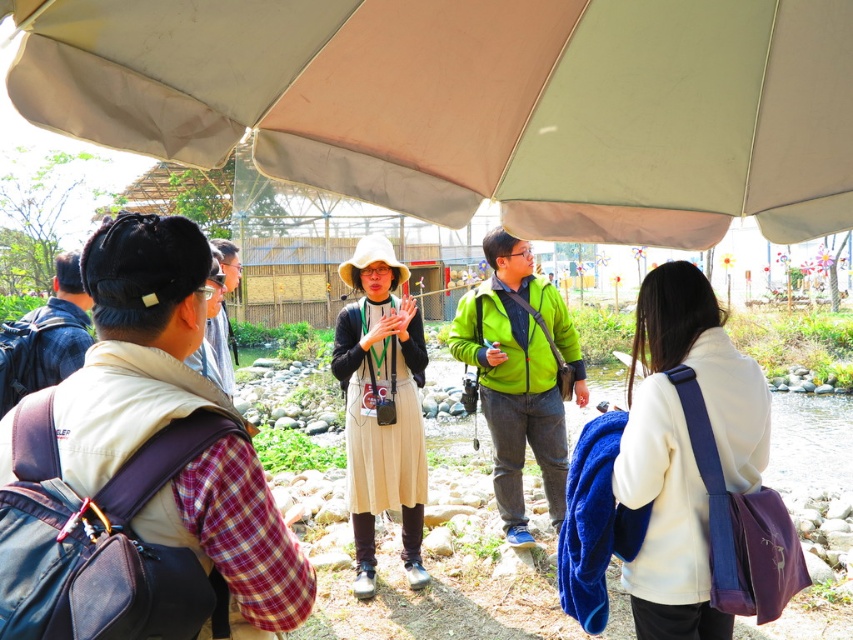
You are standing under the beige fabric canopy at upper center and want to see the plaid fabric shirt at left. Which direction should you look?

The beige fabric canopy at upper center is located above the plaid fabric shirt at left, so you should look downward to see the plaid fabric shirt at left.

From the picture: You are a photographer trying to capture a photo of the beige fabric dress at center without the beige fabric canopy at upper center blocking the view. Based on their heights, can you position yourself in a way that the dress is fully visible while the canopy is out of frame?

The beige fabric canopy at upper center is not as tall as the beige fabric dress at center, so positioning yourself lower or moving closer to the dress might allow the canopy to be out of frame while the dress remains visible.

You are planning to set up a picnic under the beige fabric canopy at upper center. You have a picnic blanket that is the same width as the plaid fabric shirt at left. Will the blanket fit entirely under the canopy?

The beige fabric canopy at upper center is wider than the plaid fabric shirt at left, so the picnic blanket will fit entirely under the canopy since the canopy is wider than the blanket.